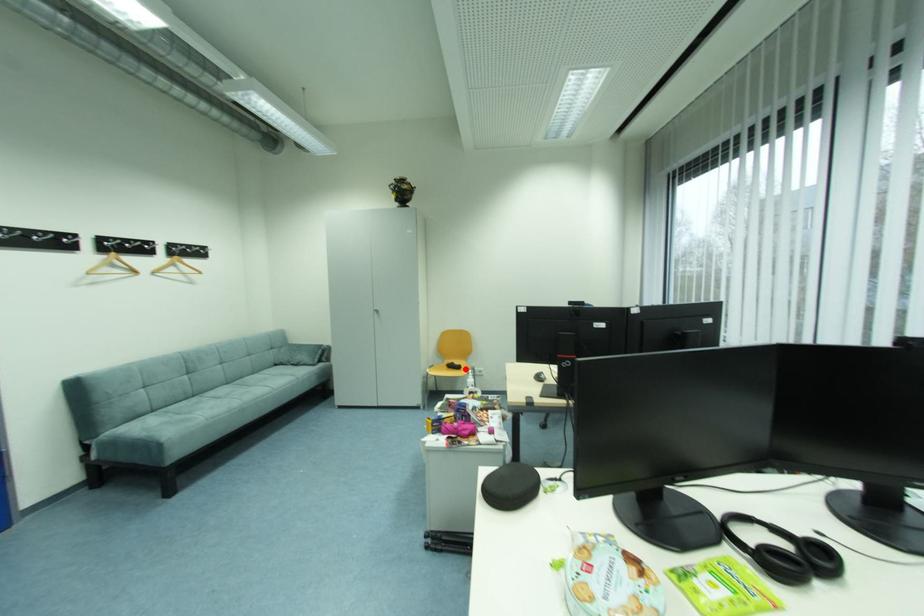
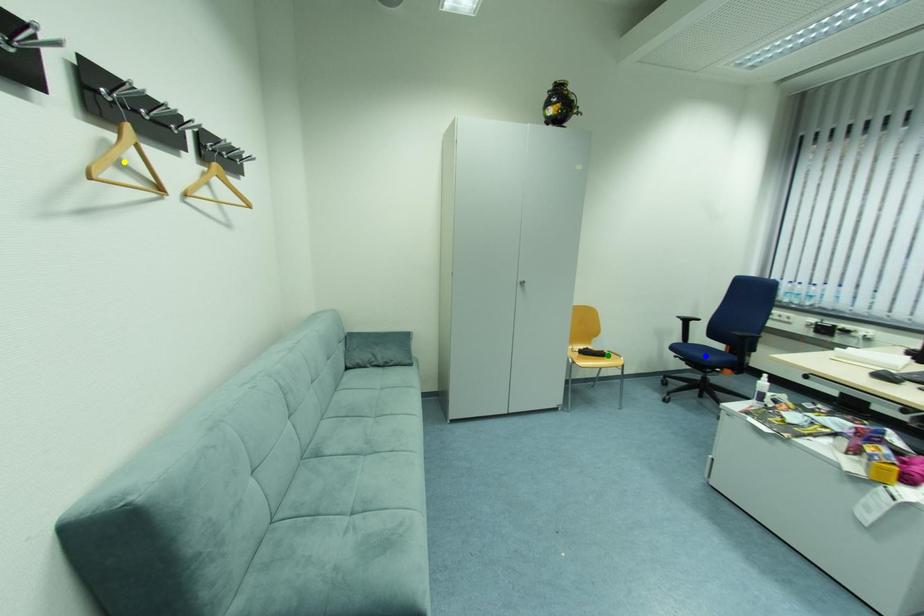
Question: I am providing you with two images of the same scene from different viewpoints. A red point is marked on the first image. You are given multiple points on the second image. Can you choose the point in image 2 that corresponds to the point in image 1?

Choices:
 (A) green point
 (B) yellow point
 (C) blue point

Answer: (A)